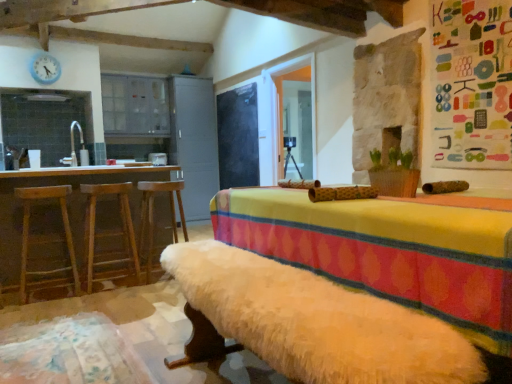
Question: Considering the positions of wooden bar stool at left, which is the 2th bar stool in left-to-right order, and wooden bar stool at left, marked as the 3th bar stool in a right-to-left arrangement, in the image, is wooden bar stool at left, which is the 2th bar stool in left-to-right order, wider or thinner than wooden bar stool at left, marked as the 3th bar stool in a right-to-left arrangement,?

Choices:
 (A) wide
 (B) thin

Answer: (B)

Question: In the image, is wooden bar stool at left, which is the 2th bar stool in left-to-right order, on the left side or the right side of wooden bar stool at left, marked as the 3th bar stool in a right-to-left arrangement?

Choices:
 (A) right
 (B) left

Answer: (A)

Question: Which is nearer to the brown wooden table at left?

Choices:
 (A) blackboard at center, positioned as the second bulletin board in front-to-back order
 (B) wooden bar stool at left, arranged as the 1th bar stool when viewed from the right
 (C) white plastic clock at upper left
 (D) wooden bar stool at left, arranged as the second bar stool when viewed from the right
 (E) colorful fabric bulletin board at upper right, arranged as the 1th bulletin board when viewed from the right

Answer: (D)

Question: Estimate the real-world distances between objects in this image. Which object is farther from the wooden bar stool at left, marked as the 3th bar stool in a right-to-left arrangement?

Choices:
 (A) white plastic clock at upper left
 (B) brown wooden table at left
 (C) blackboard at center, which ranks as the second bulletin board in right-to-left order
 (D) transparent glass door at center
 (E) fluffy white rug at lower left

Answer: (C)